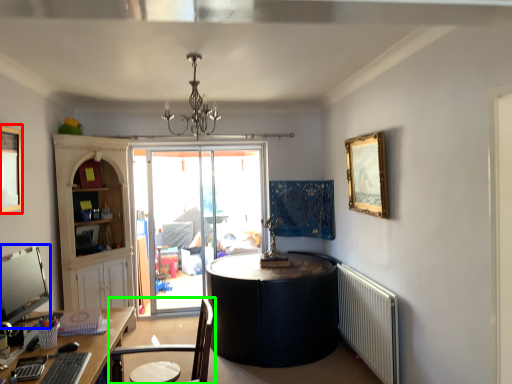
Question: Which object is the farthest from picture frame (highlighted by a red box)? Choose among these: computer monitor (highlighted by a blue box) or chair (highlighted by a green box).

Choices:
 (A) computer monitor
 (B) chair

Answer: (B)